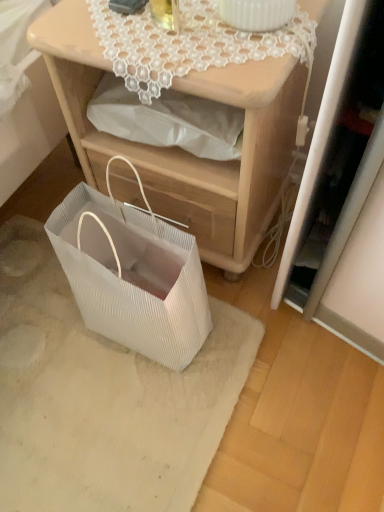
The height and width of the screenshot is (512, 384). What do you see at coordinates (102, 397) in the screenshot?
I see `white textured mat at lower left` at bounding box center [102, 397].

Locate an element on the screen. The height and width of the screenshot is (512, 384). white pleated paper bag at lower left is located at coordinates (132, 276).

Image resolution: width=384 pixels, height=512 pixels. Identify the location of white textured mat at lower left. (102, 397).

In the scene shown: Can you confirm if white pleated paper bag at lower left is smaller than white lace doily at upper center?

Actually, white pleated paper bag at lower left might be larger than white lace doily at upper center.

Is white pleated paper bag at lower left turned away from white lace doily at upper center?

Yes, white pleated paper bag at lower left is facing away from white lace doily at upper center.

Who is taller, white pleated paper bag at lower left or white lace doily at upper center?

With more height is white pleated paper bag at lower left.

Does matte wood nightstand at center come in front of white pleated paper bag at lower left?

No, it is not.

From the image's perspective, who appears lower, matte wood nightstand at center or white pleated paper bag at lower left?

white pleated paper bag at lower left, from the image's perspective.

Does point (279, 174) appear closer or farther from the camera than point (124, 218)?

Point (279, 174) appears to be farther away from the viewer than point (124, 218).

From the image's perspective, does white textured mat at lower left appear lower than matte wood nightstand at center?

Yes, from the image's perspective, white textured mat at lower left is beneath matte wood nightstand at center.

Could you tell me if white textured mat at lower left is turned towards matte wood nightstand at center?

No.

Is white textured mat at lower left outside of matte wood nightstand at center?

Yes, white textured mat at lower left is located beyond the bounds of matte wood nightstand at center.

Does matte wood nightstand at center appear on the right side of white textured mat at lower left?

Correct, you'll find matte wood nightstand at center to the right of white textured mat at lower left.

How much distance is there between matte wood nightstand at center and white textured mat at lower left?

matte wood nightstand at center and white textured mat at lower left are 14.14 inches apart.

Is matte wood nightstand at center further to the viewer compared to white textured mat at lower left?

No.

In the scene shown: Is white textured mat at lower left at the back of matte wood nightstand at center?

No, matte wood nightstand at center's orientation is not away from white textured mat at lower left.

Is white textured mat at lower left smaller than white lace doily at upper center?

Answer: No.

From the image's perspective, is white textured mat at lower left on white lace doily at upper center?

No, from the image's perspective, white textured mat at lower left is not on top of white lace doily at upper center.

Which of these two, white textured mat at lower left or white lace doily at upper center, stands shorter?

With less height is white textured mat at lower left.

Is white textured mat at lower left placed right next to white lace doily at upper center?

No.

In terms of width, does white textured mat at lower left look wider or thinner when compared to white pleated paper bag at lower left?

white textured mat at lower left is wider than white pleated paper bag at lower left.

Is white textured mat at lower left not close to white pleated paper bag at lower left?

No, white textured mat at lower left is in close proximity to white pleated paper bag at lower left.

From the image's perspective, relative to white pleated paper bag at lower left, is white textured mat at lower left above or below?

From the image's perspective, white textured mat at lower left appears below white pleated paper bag at lower left.

Is the depth of white pleated paper bag at lower left greater than that of white textured mat at lower left?

No.

Based on the photo, can we say white pleated paper bag at lower left lies outside white textured mat at lower left?

white pleated paper bag at lower left is positioned outside white textured mat at lower left.

Which is more distant, (162,350) or (5,504)?

The point (162,350) is behind.

Locate an element on the screen. The height and width of the screenshot is (512, 384). mat below the white pleated paper bag at lower left (from the image's perspective) is located at coordinates (102, 397).

This screenshot has height=512, width=384. Find the location of `lace above the white pleated paper bag at lower left (from the image's perspective)`. lace above the white pleated paper bag at lower left (from the image's perspective) is located at coordinates (189, 44).

Where is `nightstand that is above the white pleated paper bag at lower left (from a real-world perspective)`? The height and width of the screenshot is (512, 384). nightstand that is above the white pleated paper bag at lower left (from a real-world perspective) is located at coordinates (184, 151).

Looking at the image, which one is located closer to matte wood nightstand at center, white textured mat at lower left or white pleated paper bag at lower left?

white pleated paper bag at lower left.

Which object lies nearer to the anchor point white textured mat at lower left, matte wood nightstand at center or white lace doily at upper center?

matte wood nightstand at center is closer to white textured mat at lower left.

Considering their positions, is white pleated paper bag at lower left positioned closer to white lace doily at upper center than matte wood nightstand at center?

matte wood nightstand at center lies closer to white lace doily at upper center than the other object.

When comparing their distances from white pleated paper bag at lower left, does white lace doily at upper center or matte wood nightstand at center seem closer?

Based on the image, matte wood nightstand at center appears to be nearer to white pleated paper bag at lower left.

Looking at the image, which one is located further to matte wood nightstand at center, white lace doily at upper center or white textured mat at lower left?

white textured mat at lower left is positioned further to the anchor matte wood nightstand at center.

Estimate the real-world distances between objects in this image. Which object is further from white textured mat at lower left, matte wood nightstand at center or white pleated paper bag at lower left?

matte wood nightstand at center lies further to white textured mat at lower left than the other object.

Which object lies nearer to the anchor point white lace doily at upper center, white pleated paper bag at lower left or white textured mat at lower left?

Based on the image, white pleated paper bag at lower left appears to be nearer to white lace doily at upper center.

Which object lies further to the anchor point white pleated paper bag at lower left, white textured mat at lower left or white lace doily at upper center?

The object further to white pleated paper bag at lower left is white lace doily at upper center.

You are a GUI agent. You are given a task and a screenshot of the screen. Output one action in this format:
    pyautogui.click(x=<x>, y=<y>)
    Task: Click on the gift basket between matte wood nightstand at center and white textured mat at lower left in the vertical direction
    The image size is (384, 512).
    Given the screenshot: What is the action you would take?
    pyautogui.click(x=132, y=276)

Locate an element on the screen. This screenshot has width=384, height=512. nightstand between white lace doily at upper center and white pleated paper bag at lower left in the vertical direction is located at coordinates (184, 151).

Find the location of `nightstand between white lace doily at upper center and white textured mat at lower left in the vertical direction`. nightstand between white lace doily at upper center and white textured mat at lower left in the vertical direction is located at coordinates (184, 151).

I want to click on gift basket between white lace doily at upper center and white textured mat at lower left in the up-down direction, so click(132, 276).